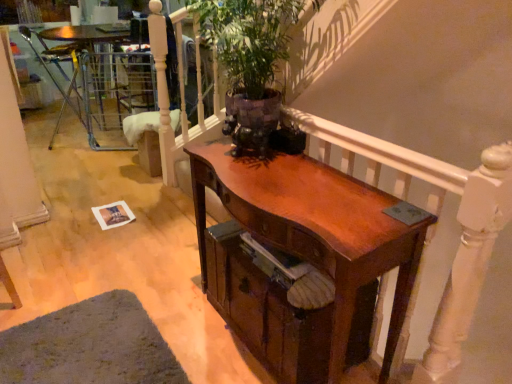
In order to click on vacant area to the left of shiny brown desk at center in this screenshot , I will do `click(174, 310)`.